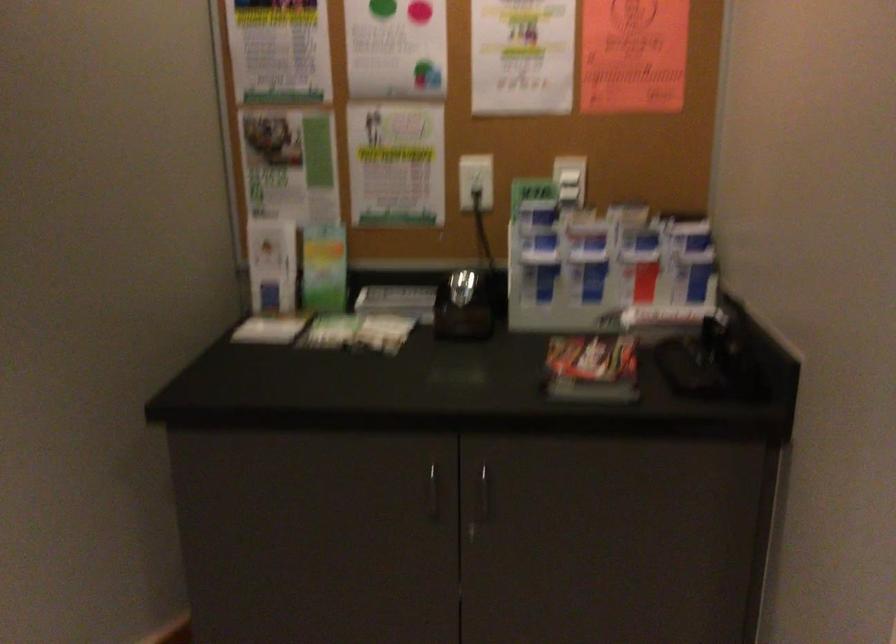
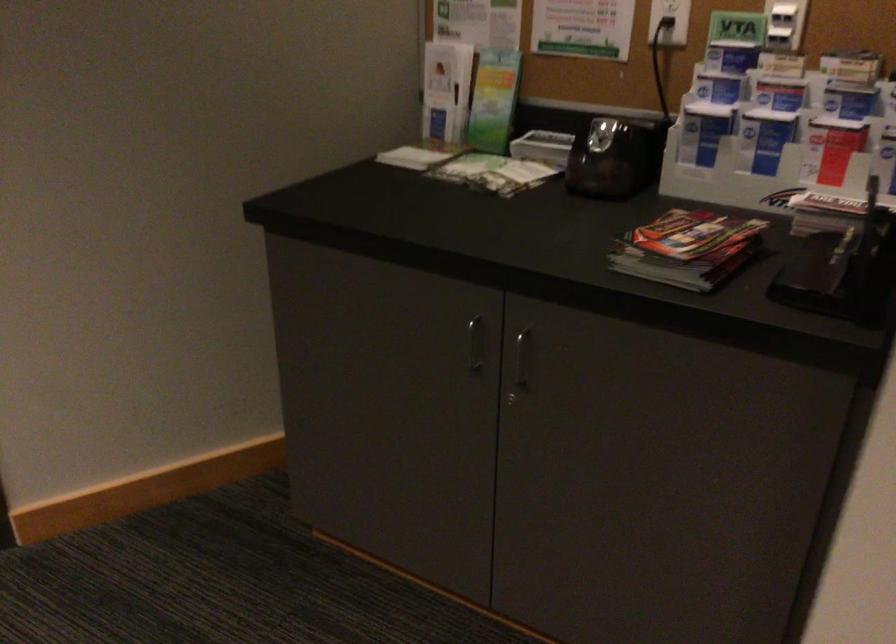
Locate, in the second image, the point that corresponds to the point at 481,187 in the first image.

(669, 21)